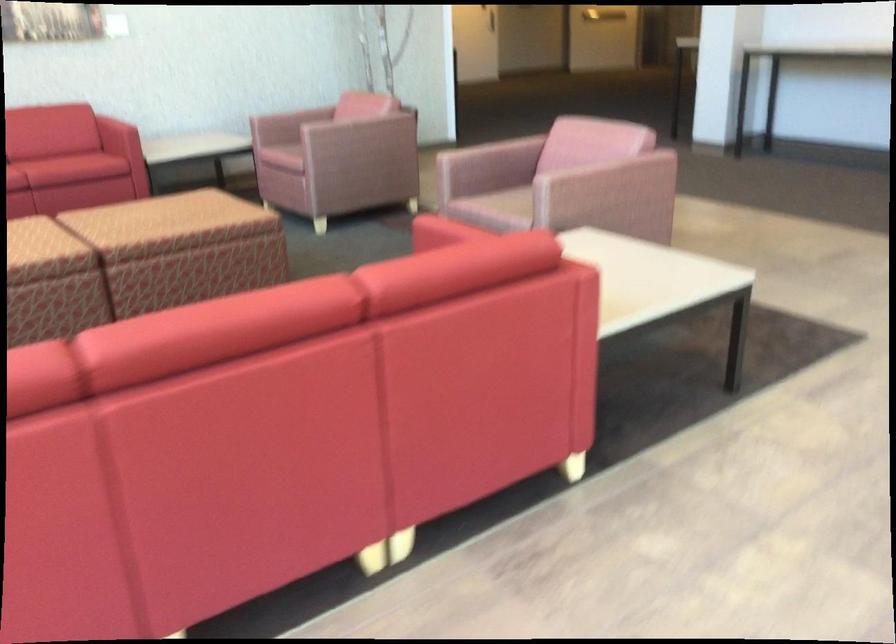
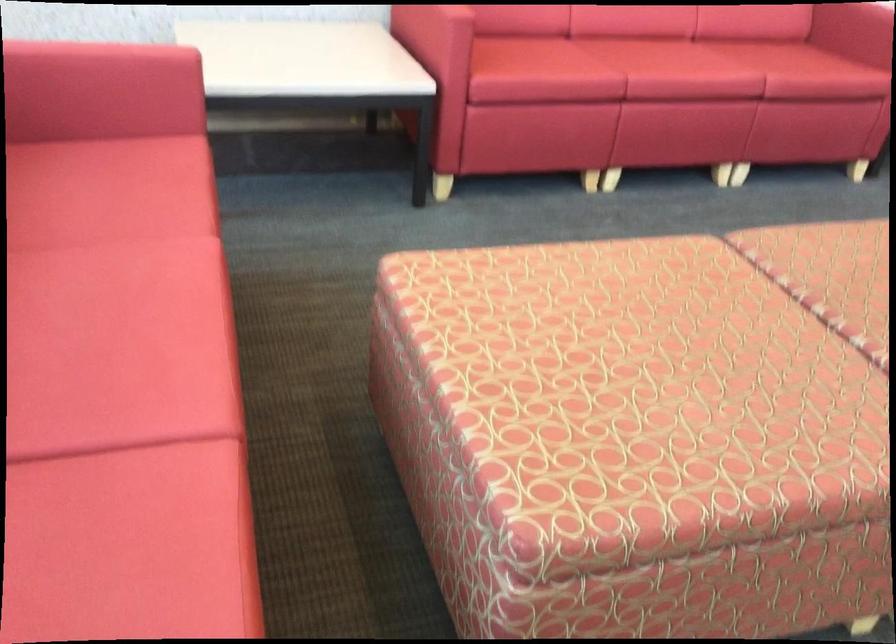
In a continuous first-person perspective shot, in which direction is the camera moving?

The movement direction of the cameraman is left, forward.